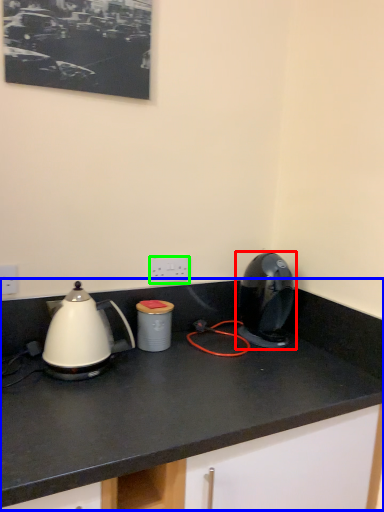
Question: Which object is the closest to the home appliance (highlighted by a red box)? Choose among these: countertop (highlighted by a blue box) or electric outlet (highlighted by a green box).

Choices:
 (A) countertop
 (B) electric outlet

Answer: (A)